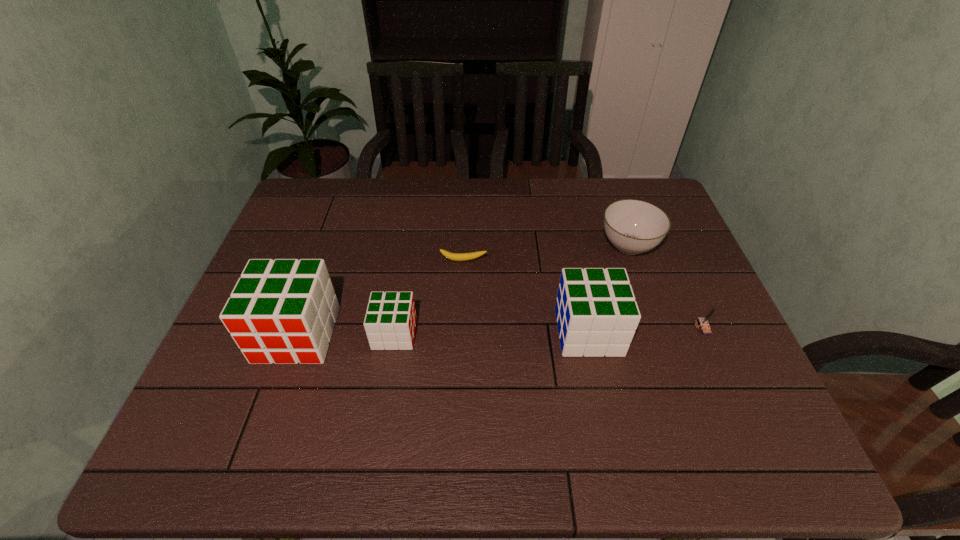
Select which object is the fifth closest to the fifth object from right to left. Please provide its 2D coordinates. Your answer should be formatted as a tuple, i.e. [(x, y)], where the tuple contains the x and y coordinates of a point satisfying the conditions above.

[(703, 322)]

In order to click on object that ranks as the fourth closest to the shortest object in this screenshot , I will do `click(632, 226)`.

Where is `the second closest cube to the shortest cube`? Image resolution: width=960 pixels, height=540 pixels. the second closest cube to the shortest cube is located at coordinates (597, 315).

Identify which cube is the second nearest to the banana. Please provide its 2D coordinates. Your answer should be formatted as a tuple, i.e. [(x, y)], where the tuple contains the x and y coordinates of a point satisfying the conditions above.

[(597, 315)]

This screenshot has height=540, width=960. In order to click on free space that satisfies the following two spatial constraints: 1. on the red face of the second object from left to right; 2. on the red face of the leftmost cube in this screenshot , I will do `click(395, 334)`.

Find the location of a particular element. This screenshot has width=960, height=540. blank space that satisfies the following two spatial constraints: 1. on the upward curve of the banana; 2. on the right side of the rightmost object is located at coordinates (461, 327).

The width and height of the screenshot is (960, 540). In order to click on free location that satisfies the following two spatial constraints: 1. on the upward curve of the third object from left to right; 2. on the right side of the rightmost object in this screenshot , I will do `click(461, 327)`.